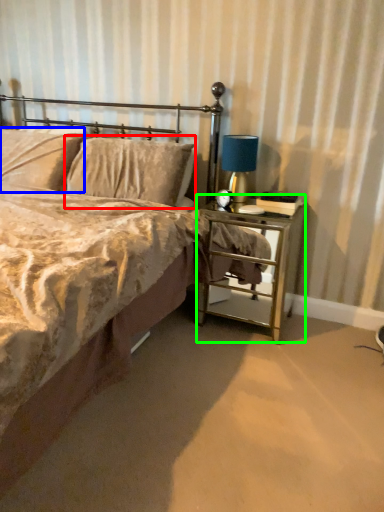
Question: Considering the real-world distances, which object is farthest from pillow (highlighted by a red box)? pillow (highlighted by a blue box) or nightstand (highlighted by a green box)?

Choices:
 (A) pillow
 (B) nightstand

Answer: (B)